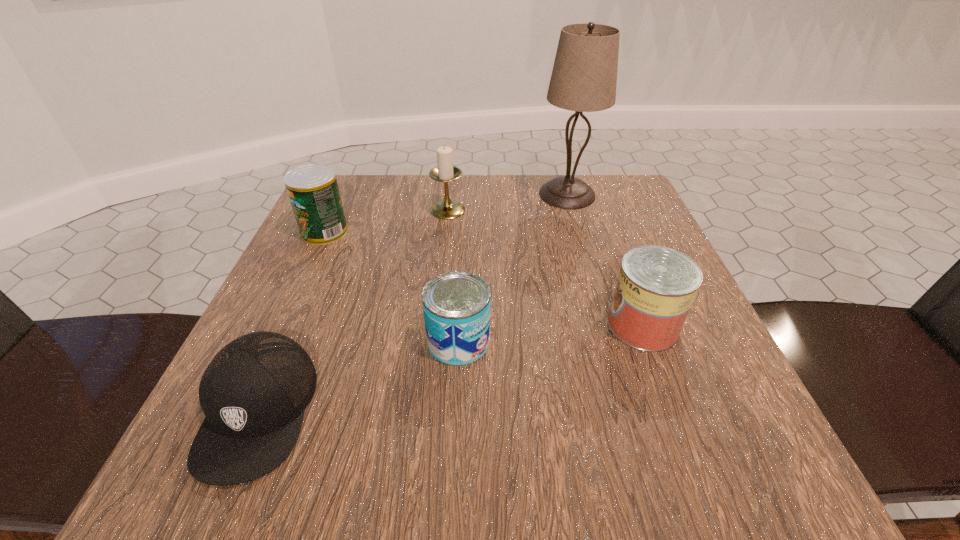
At what (x,y) coordinates should I click in order to perform the action: click on the third closest can to the cap. Please return your answer as a coordinate pair (x, y). This screenshot has height=540, width=960. Looking at the image, I should click on [656, 286].

This screenshot has width=960, height=540. I want to click on can that stands as the closest to the cap, so click(456, 305).

I want to click on free space that satisfies the following two spatial constraints: 1. on the front-facing side of the rightmost can; 2. on the left side of the tallest object, so click(605, 325).